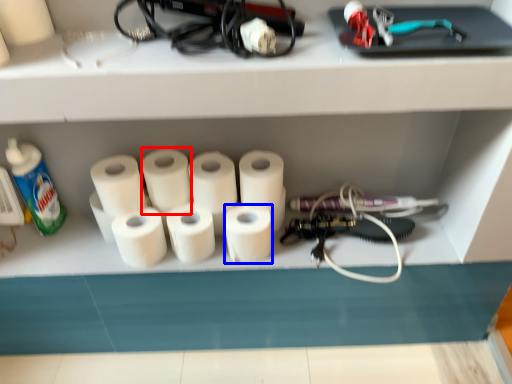
Question: Which object is further to the camera taking this photo, toilet paper (highlighted by a red box) or toilet paper (highlighted by a blue box)?

Choices:
 (A) toilet paper
 (B) toilet paper

Answer: (A)